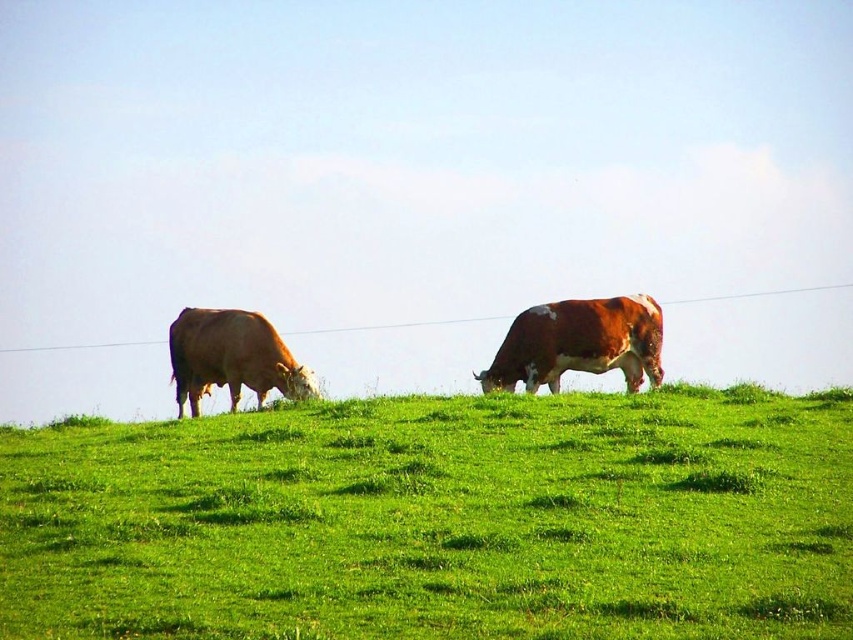
Can you confirm if brown speckled cow at center is positioned below brown smooth cow at left?

No, brown speckled cow at center is not below brown smooth cow at left.

Between point (518, 362) and point (235, 381), which one is positioned in front?

Positioned in front is point (235, 381).

Identify the location of brown speckled cow at center. (579, 342).

Locate an element on the screen. brown speckled cow at center is located at coordinates (579, 342).

Can you confirm if green grassy hillside at center is positioned to the left of brown smooth cow at left?

No, green grassy hillside at center is not to the left of brown smooth cow at left.

Which of these two, green grassy hillside at center or brown smooth cow at left, stands taller?

Standing taller between the two is brown smooth cow at left.

In order to click on green grassy hillside at center in this screenshot , I will do `click(438, 518)`.

Which is more to the right, green grassy hillside at center or brown speckled cow at center?

Positioned to the right is brown speckled cow at center.

Is point (369, 499) more distant than point (544, 364)?

No, it is not.

At what (x,y) coordinates should I click in order to perform the action: click on green grassy hillside at center. Please return your answer as a coordinate pair (x, y). Looking at the image, I should click on (438, 518).